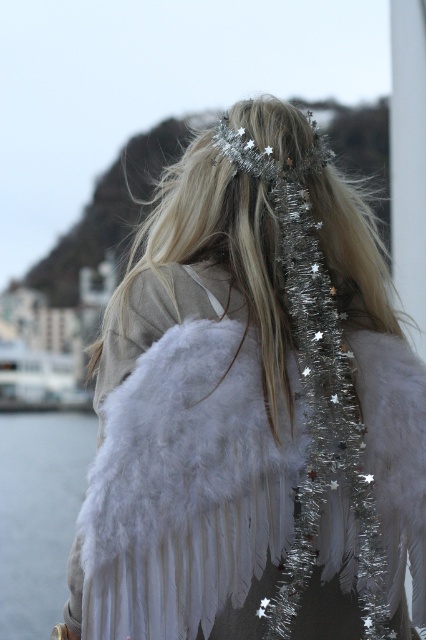
Between white feathered wings at center and transparent water at lower left, which one is positioned higher?

Positioned higher is white feathered wings at center.

Who is positioned more to the left, white feathered wings at center or transparent water at lower left?

transparent water at lower left is more to the left.

Is point (104, 465) positioned before point (43, 420)?

Yes.

Where is `white feathered wings at center`? white feathered wings at center is located at coordinates (252, 408).